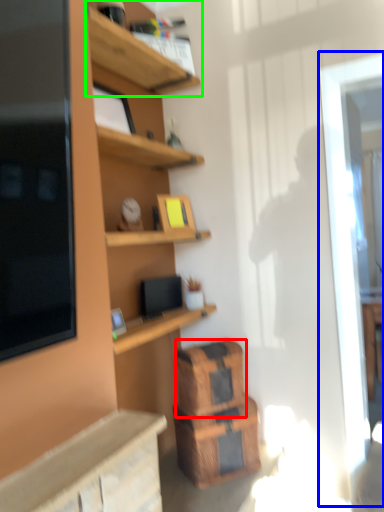
Question: Considering the real-world distances, which object is closest to crate (highlighted by a red box)? glass door (highlighted by a blue box) or shelf (highlighted by a green box).

Choices:
 (A) glass door
 (B) shelf

Answer: (A)